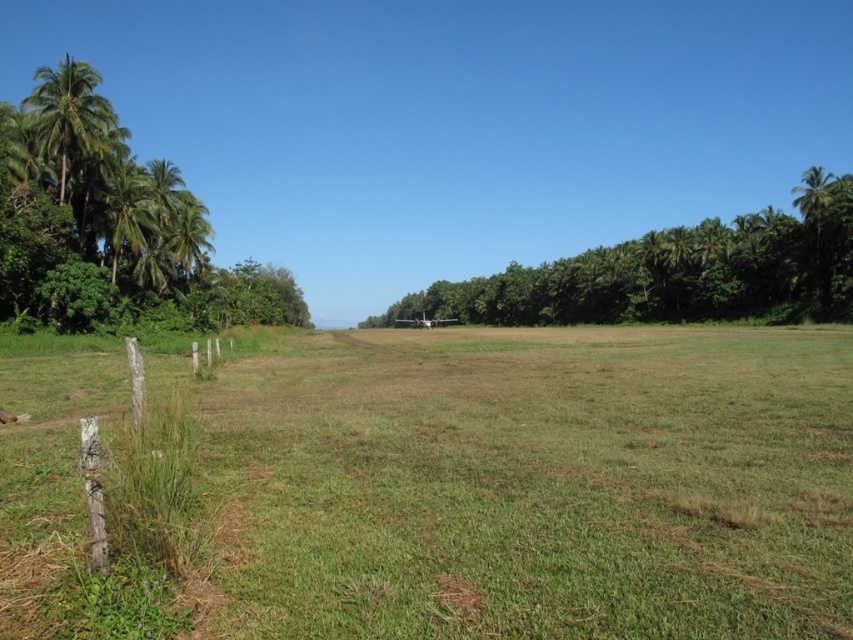
You are standing on the grassy field in the rural scene and see two points marked on the ground. The first point is at coordinate point (619, 314) and the second is at point (108, 208). Which point is closer to you?

Point (108, 208) is closer to you because it is less further to the camera than point (619, 314).

You are standing in the middle of the grassy field and see the green leafy palm tree at right and the green leafy palm tree at left. Which palm tree is located to the right side of the other?

The green leafy palm tree at right is located to the right of the green leafy palm tree at left.